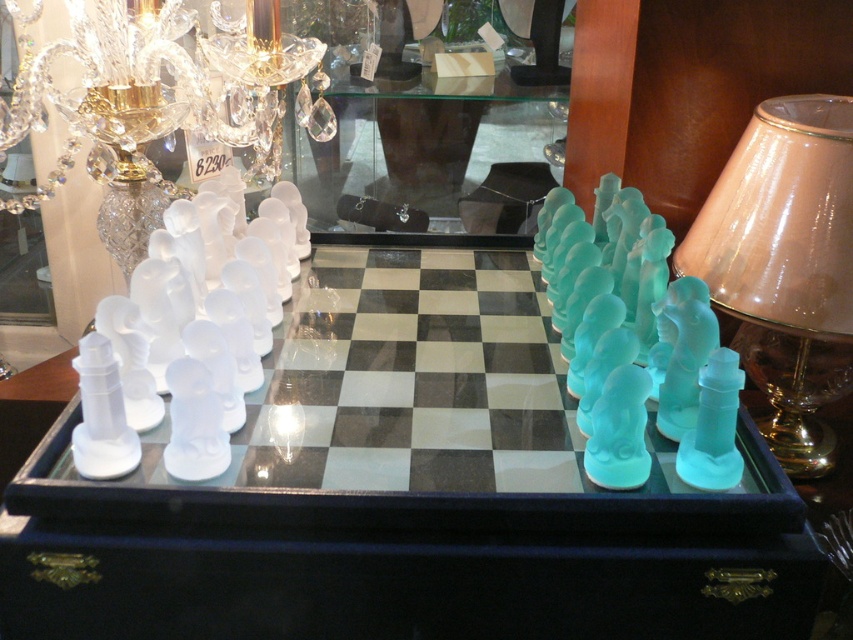
You are a delivery person who needs to place a large package on the table without touching the chessboard. Can you fit the package between the translucent glass chessboard at center and the transparent glass table at center if the package is 70 centimeters wide?

The distance between the translucent glass chessboard at center and the transparent glass table at center is 75.03 centimeters. Since the package is 70 centimeters wide, it can fit between them as there is enough space.

You are standing in front of the glass chessboard display and want to place a small ornament on the translucent glass lampshade at right. Based on its position, can you confirm if the lampshade is positioned to the right side of the chessboard?

The translucent glass lampshade at right is located at point (785, 266), which places it to the right side of the chessboard. Therefore, you can safely place the ornament there.

You are standing in front of a display case containing a chessboard and other items. You see a point marked at coordinates (405,493). Based on the chessboard and its position, what object is located at that point?

The point at coordinates (405,493) marks the translucent glass chessboard at center.